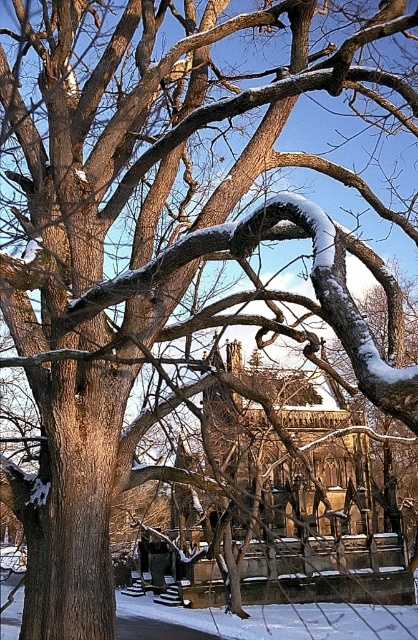
Question: Which point is farther to the camera?

Choices:
 (A) wooden park bench at center
 (B) wooden park bench at lower center

Answer: (B)

Question: Is wooden park bench at center wider than wooden park bench at lower center?

Choices:
 (A) no
 (B) yes

Answer: (B)

Question: Which object appears farthest from the camera in this image?

Choices:
 (A) wooden park bench at lower center
 (B) wooden park bench at center

Answer: (A)

Question: Is wooden park bench at center further to camera compared to wooden park bench at lower center?

Choices:
 (A) yes
 (B) no

Answer: (B)

Question: Observing the image, what is the correct spatial positioning of wooden park bench at center in reference to wooden park bench at lower center?

Choices:
 (A) right
 (B) left

Answer: (A)

Question: Which point is closer to the camera taking this photo?

Choices:
 (A) (142, 589)
 (B) (168, 580)

Answer: (B)